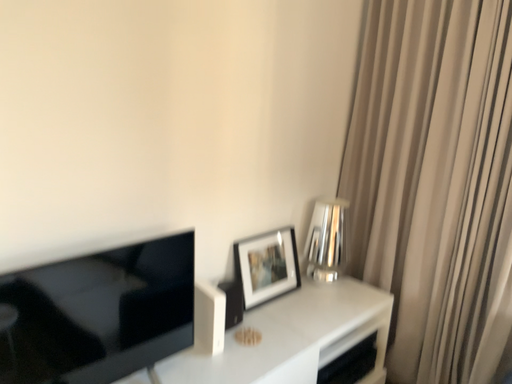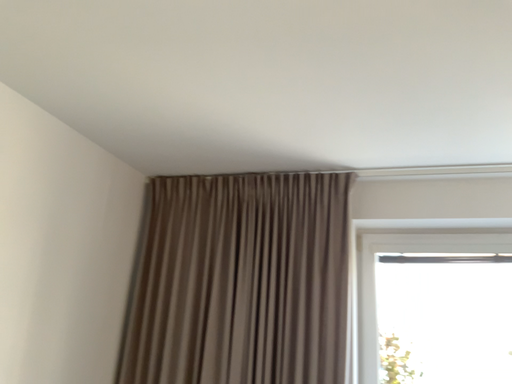
Question: How did the camera likely rotate when shooting the video?

Choices:
 (A) rotated downward
 (B) rotated upward

Answer: (B)